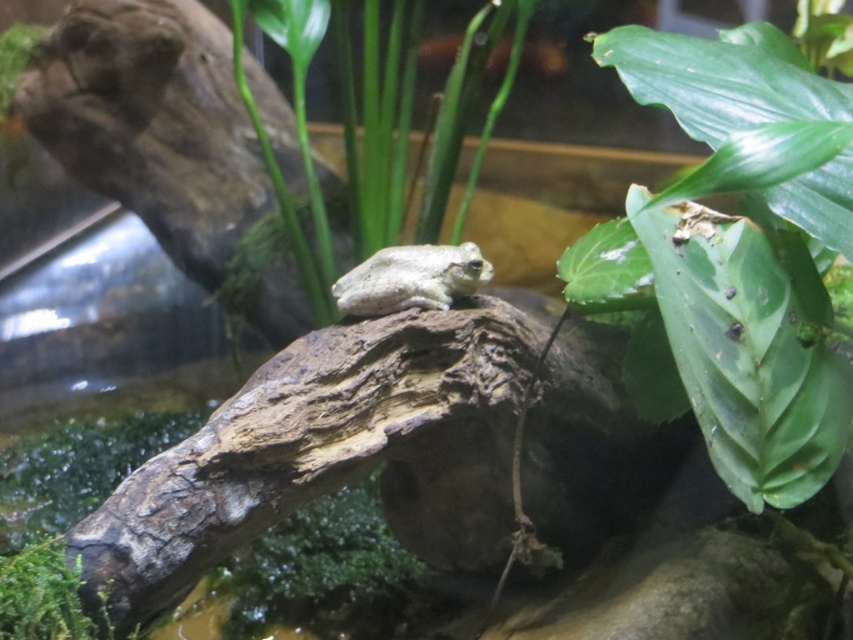
Who is lower down, green matte leaf at upper right or gray matte frog at center?

gray matte frog at center is lower down.

Which is in front, point (630, 260) or point (474, 289)?

Positioned in front is point (630, 260).

The image size is (853, 640). I want to click on green matte leaf at upper right, so click(x=741, y=252).

This screenshot has height=640, width=853. What do you see at coordinates (741, 252) in the screenshot?
I see `green matte leaf at upper right` at bounding box center [741, 252].

Identify the location of green matte leaf at upper right. (741, 252).

What do you see at coordinates (741, 252) in the screenshot?
I see `green matte leaf at upper right` at bounding box center [741, 252].

The image size is (853, 640). Identify the location of green matte leaf at upper right. (741, 252).

Based on the photo, between green leafy plant at center and green mossy rock at lower left, which one appears on the left side from the viewer's perspective?

Positioned to the left is green mossy rock at lower left.

Does green leafy plant at center appear over green mossy rock at lower left?

Yes, green leafy plant at center is above green mossy rock at lower left.

This screenshot has width=853, height=640. What do you see at coordinates (379, 124) in the screenshot?
I see `green leafy plant at center` at bounding box center [379, 124].

Find the location of a particular element. The image size is (853, 640). green leafy plant at center is located at coordinates 379,124.